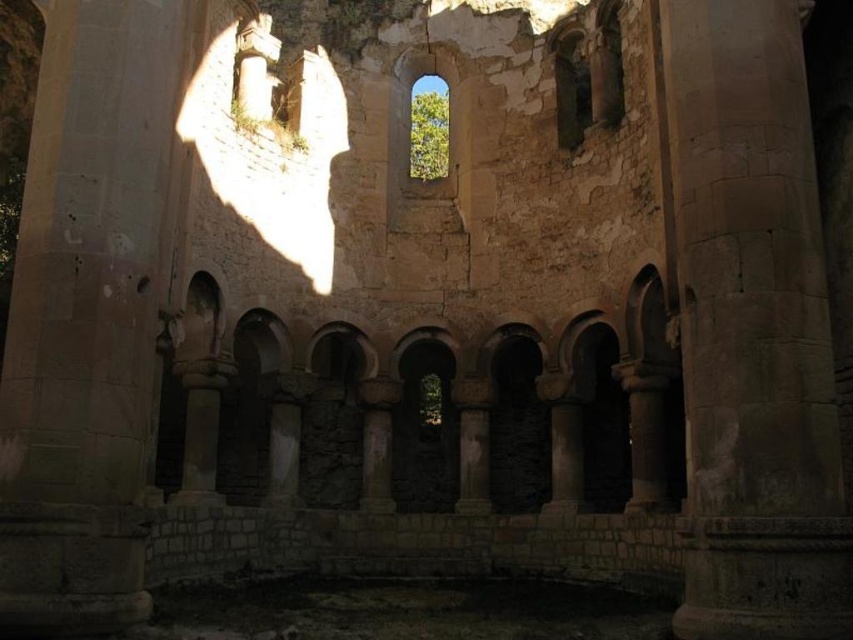
Question: In this image, where is gray stone column at center located relative to clear glass window at upper center?

Choices:
 (A) left
 (B) right

Answer: (B)

Question: Can you confirm if gray stone column at center is smaller than clear glass window at upper center?

Choices:
 (A) no
 (B) yes

Answer: (A)

Question: Which object is farther from the camera taking this photo?

Choices:
 (A) clear glass window at upper center
 (B) gray stone column at center

Answer: (A)

Question: Can you confirm if gray stone column at center is positioned to the right of clear glass window at upper center?

Choices:
 (A) no
 (B) yes

Answer: (B)

Question: Among these points, which one is farthest from the camera?

Choices:
 (A) (426, 129)
 (B) (744, 288)

Answer: (A)